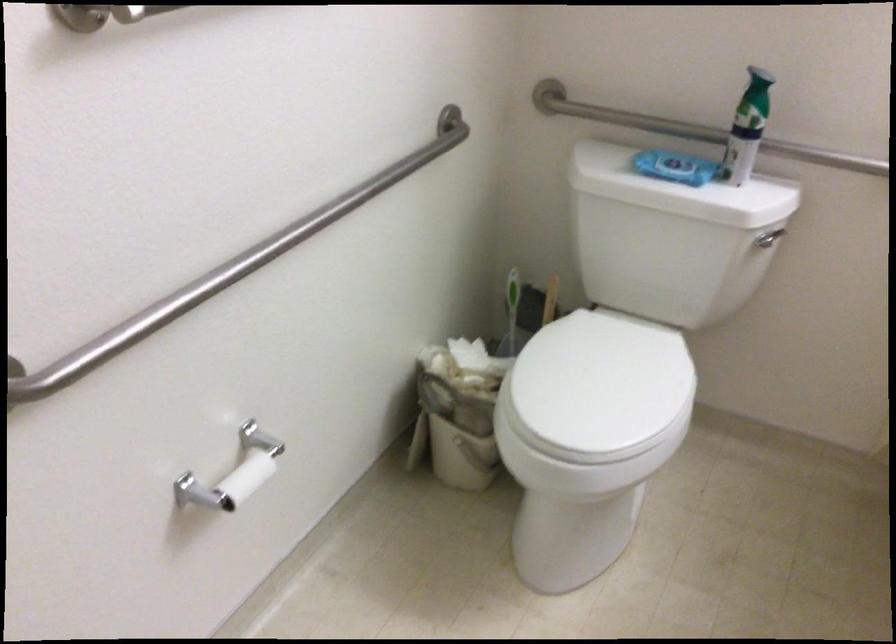
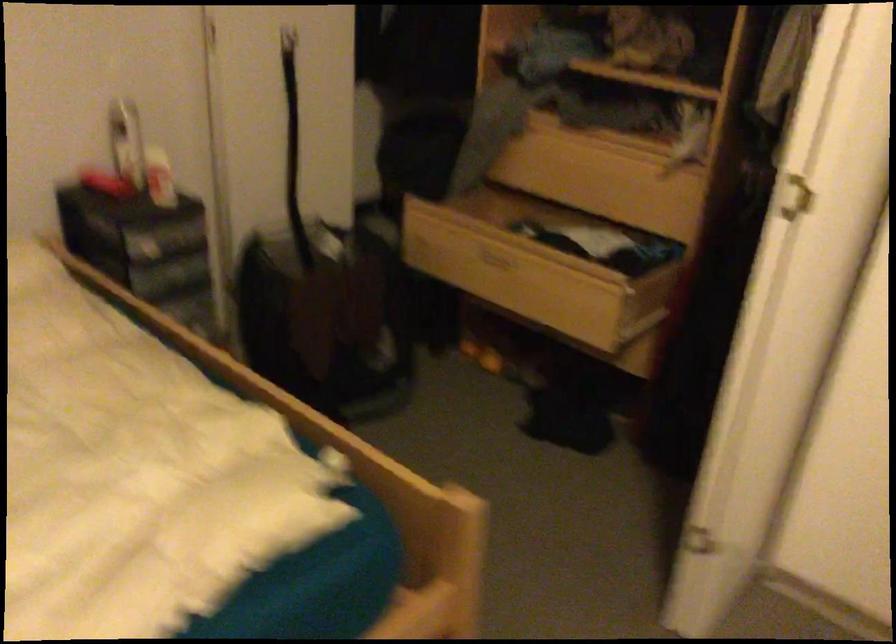
Question: I am providing you with two images of the same scene from different viewpoints. After the viewpoint changes to image2, which objects are now occluded?

Choices:
 (A) open wooden drawer
 (B) white toilet tank lid
 (C) black running shoe
 (D) white door handle

Answer: (B)